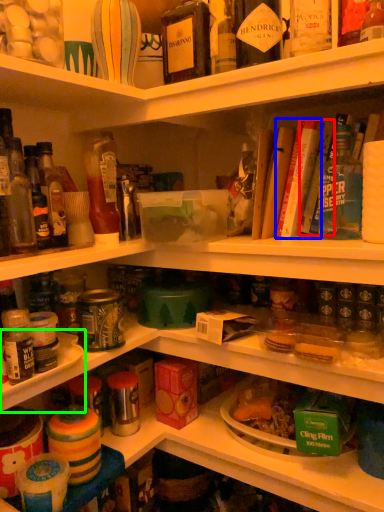
Question: Which object is the closest to the book (highlighted by a red box)? Choose among these: book (highlighted by a blue box) or shelf (highlighted by a green box).

Choices:
 (A) book
 (B) shelf

Answer: (A)